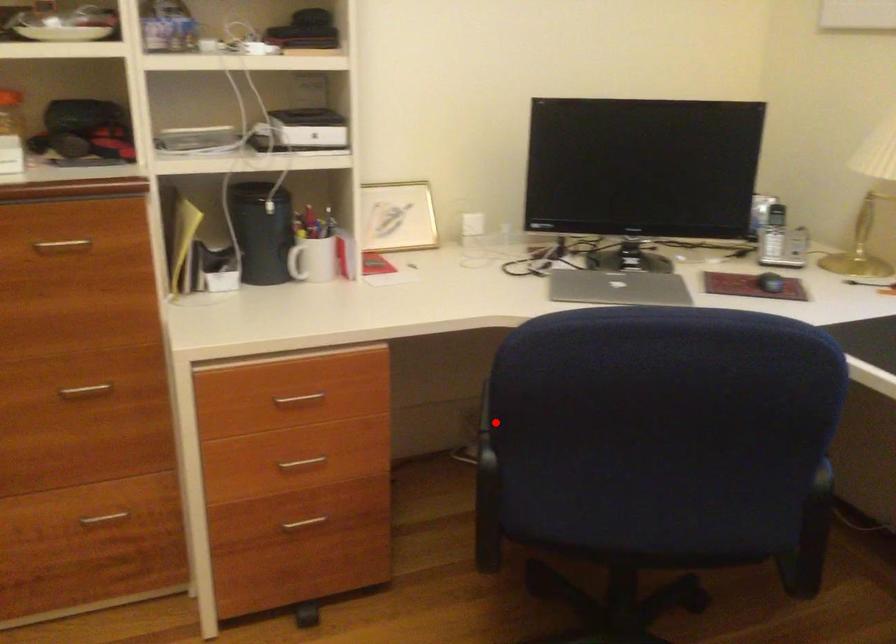
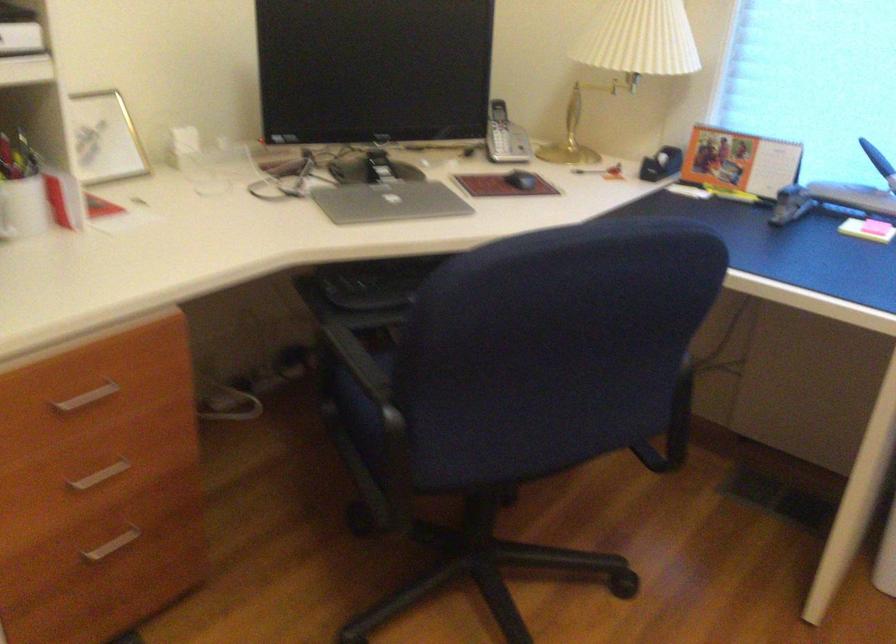
The point at the highlighted location is marked in the first image. Where is the corresponding point in the second image?

(365, 375)